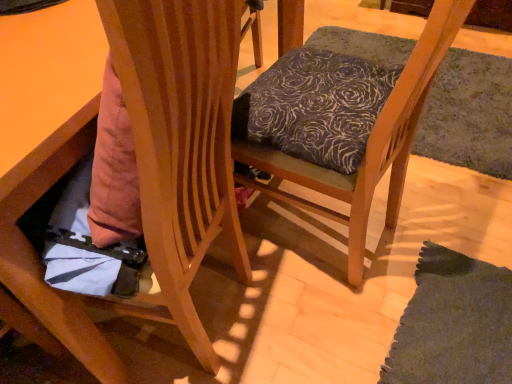
Find the location of a particular element. The image size is (512, 384). free location in front of textured fabric cushion at center, positioned as the 2th chair in left-to-right order is located at coordinates (315, 315).